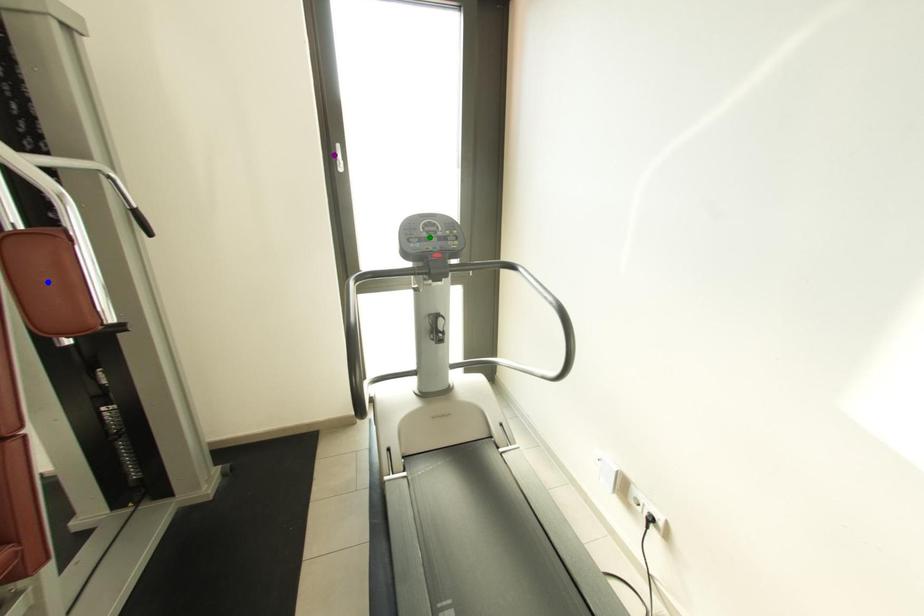
Order these from nearest to farthest:
blue point
green point
purple point

blue point < green point < purple point